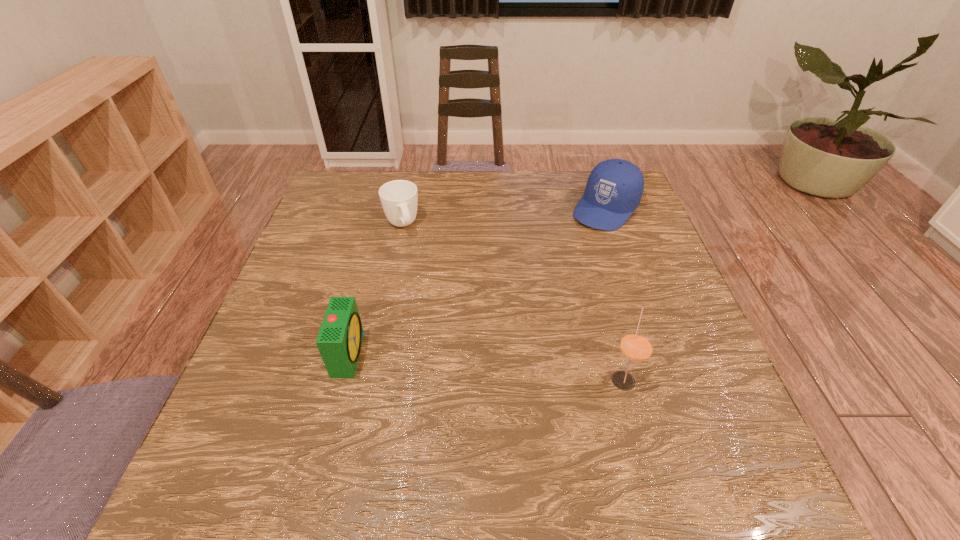
Image resolution: width=960 pixels, height=540 pixels. Identify the location of alarm clock. (339, 341).

Find the location of `straw`. straw is located at coordinates (636, 346).

At what (x,y) coordinates should I click in order to perform the action: click on cap. Please return your answer as a coordinate pair (x, y). This screenshot has width=960, height=540. Looking at the image, I should click on (614, 188).

Where is `cup`? cup is located at coordinates (399, 198).

This screenshot has height=540, width=960. I want to click on vacant space situated on the front-facing side of the alarm clock, so click(461, 354).

I want to click on vacant space situated on the back of the straw, so click(605, 313).

Image resolution: width=960 pixels, height=540 pixels. I want to click on vacant space located 0.140m on the front-facing side of the cap, so pyautogui.click(x=567, y=254).

Where is `blank area located 0.100m on the front-facing side of the cap`? The image size is (960, 540). blank area located 0.100m on the front-facing side of the cap is located at coordinates (575, 246).

Locate an element on the screen. This screenshot has width=960, height=540. vacant space positioned on the front-facing side of the cap is located at coordinates (548, 275).

Find the location of `vacant space located 0.330m with the handle on the side of the cup`. vacant space located 0.330m with the handle on the side of the cup is located at coordinates (442, 328).